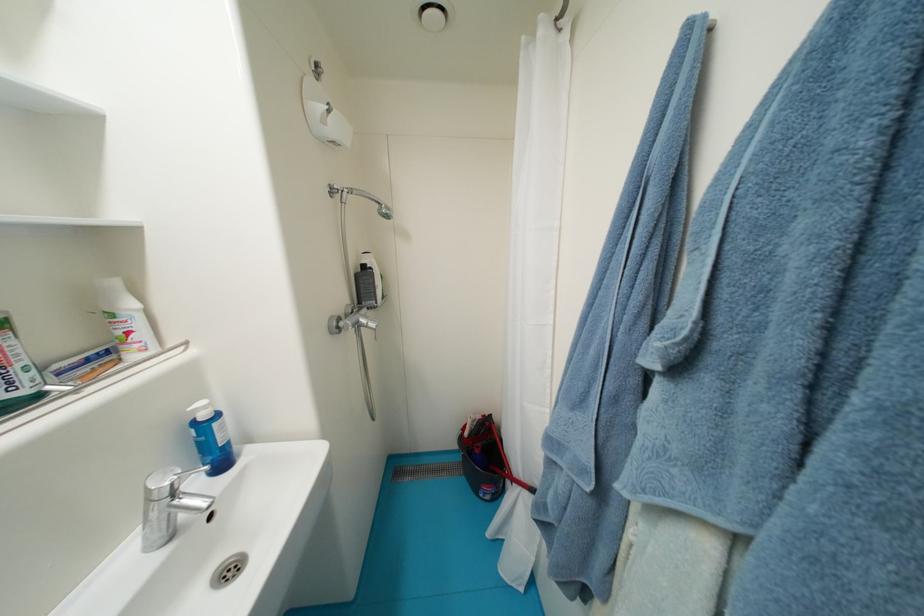
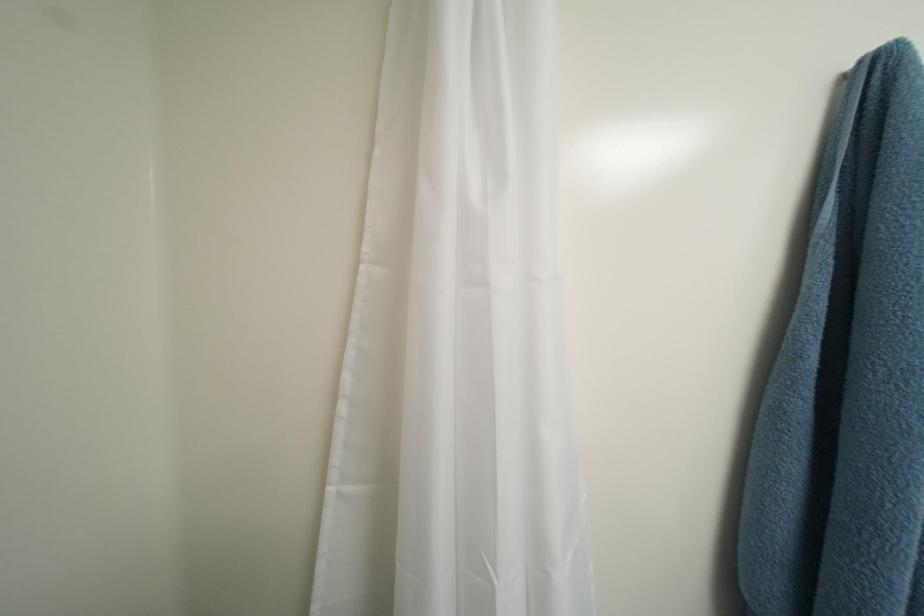
Question: The camera is either moving clockwise (left) or counter-clockwise (right) around the object. The first image is from the beginning of the video and the second image is from the end. Is the camera moving left or right when shooting the video?

Choices:
 (A) Left
 (B) Right

Answer: (A)